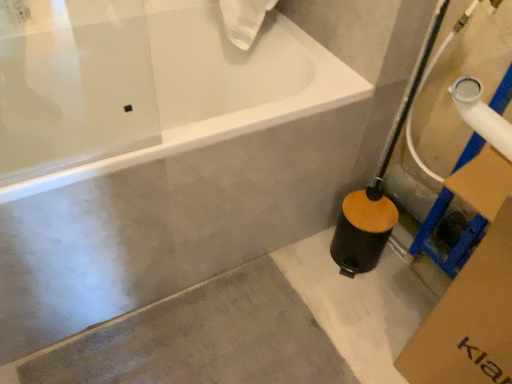
Question: From a real-world perspective, is gray concrete at lower left positioned above or below white glossy bathtub at upper center?

Choices:
 (A) below
 (B) above

Answer: (A)

Question: Considering their positions, is gray concrete at lower left located in front of or behind white glossy bathtub at upper center?

Choices:
 (A) behind
 (B) front

Answer: (A)

Question: In terms of size, does gray concrete at lower left appear bigger or smaller than white glossy bathtub at upper center?

Choices:
 (A) small
 (B) big

Answer: (A)

Question: Does point (331, 56) appear closer or farther from the camera than point (393, 294)?

Choices:
 (A) farther
 (B) closer

Answer: (B)

Question: Looking at the image, does white glossy bathtub at upper center seem bigger or smaller compared to gray concrete at lower left?

Choices:
 (A) small
 (B) big

Answer: (B)

Question: Would you say white glossy bathtub at upper center is to the left or to the right of gray concrete at lower left in the picture?

Choices:
 (A) left
 (B) right

Answer: (A)

Question: Considering their positions, is white glossy bathtub at upper center located in front of or behind gray concrete at lower left?

Choices:
 (A) front
 (B) behind

Answer: (A)